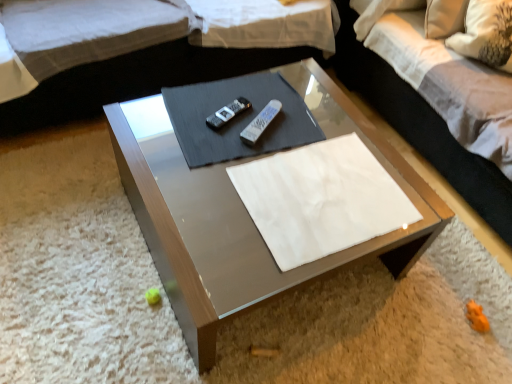
I want to click on vacant point to the right of white plastic remote at center, acting as the 1th remote starting from the right, so click(x=313, y=131).